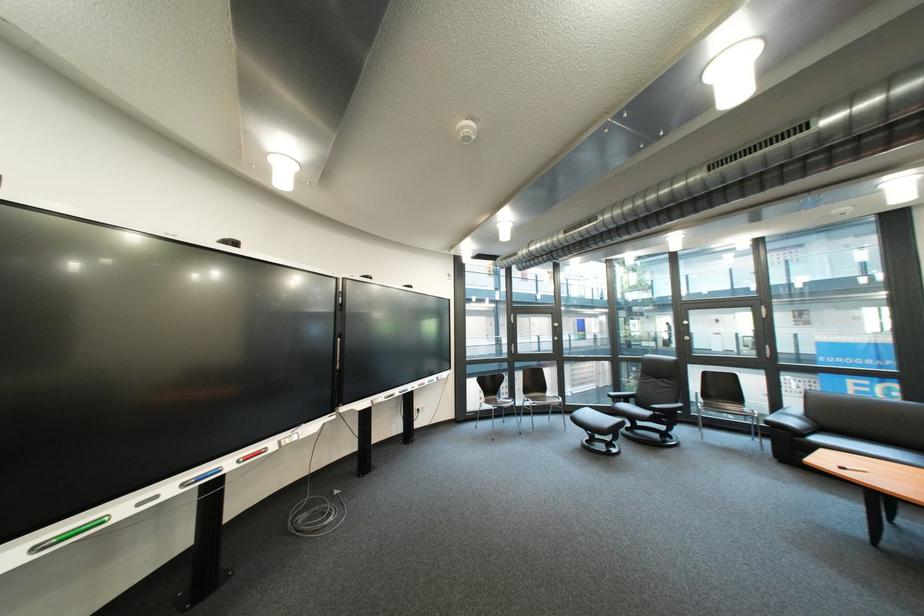
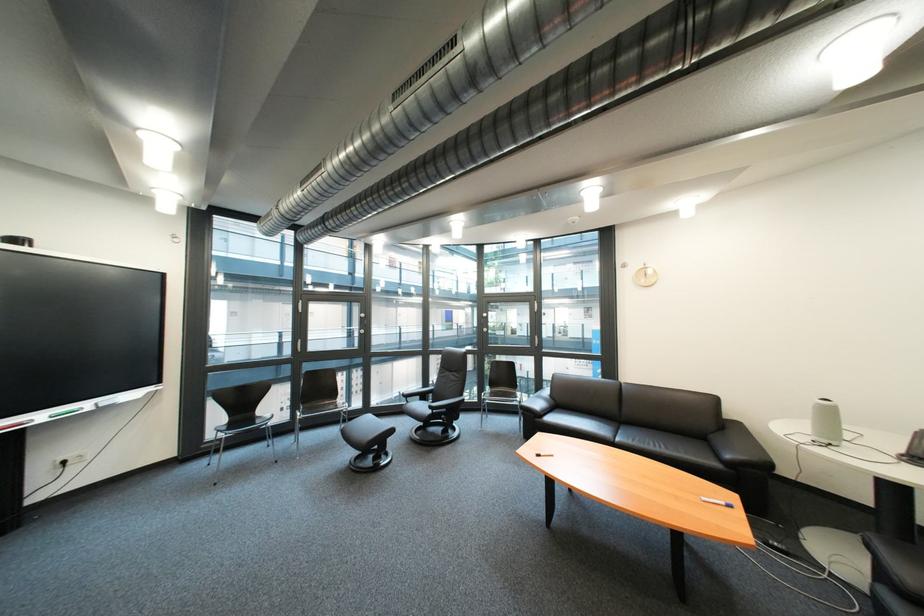
Locate, in the second image, the point that corresponds to point (806, 423) in the first image.

(551, 406)